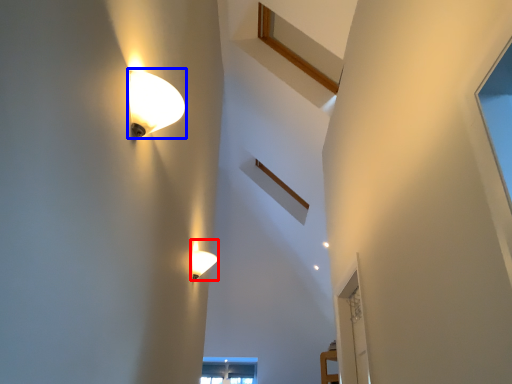
Question: Which object is further to the camera taking this photo, lamp (highlighted by a red box) or lamp (highlighted by a blue box)?

Choices:
 (A) lamp
 (B) lamp

Answer: (A)